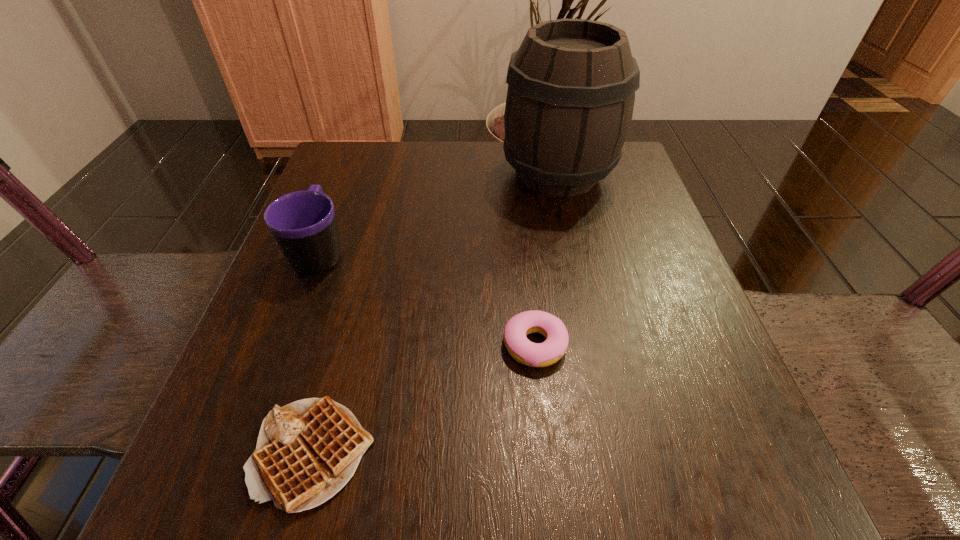
What are the coordinates of `wine bucket` in the screenshot? It's located at (571, 90).

Image resolution: width=960 pixels, height=540 pixels. In order to click on the tallest object in this screenshot , I will do `click(571, 90)`.

Find the location of a particular element. This screenshot has height=540, width=960. the second tallest object is located at coordinates (303, 223).

The width and height of the screenshot is (960, 540). I want to click on the third nearest object, so click(303, 223).

Where is `the third farthest object`? This screenshot has height=540, width=960. the third farthest object is located at coordinates (524, 351).

Image resolution: width=960 pixels, height=540 pixels. Find the location of `waffle`. waffle is located at coordinates (307, 451).

Locate an element on the screen. This screenshot has height=540, width=960. vacant area situated 0.270m on the left of the tallest object is located at coordinates (385, 174).

Identify the location of vacant space located 0.210m with the handle on the side of the third shortest object. (350, 168).

Locate an element on the screen. The width and height of the screenshot is (960, 540). vacant space located 0.230m with the handle on the side of the third shortest object is located at coordinates (352, 164).

At what (x,y) coordinates should I click in order to perform the action: click on free location located with the handle on the side of the third shortest object. Please return your answer as a coordinate pair (x, y). Looking at the image, I should click on (349, 173).